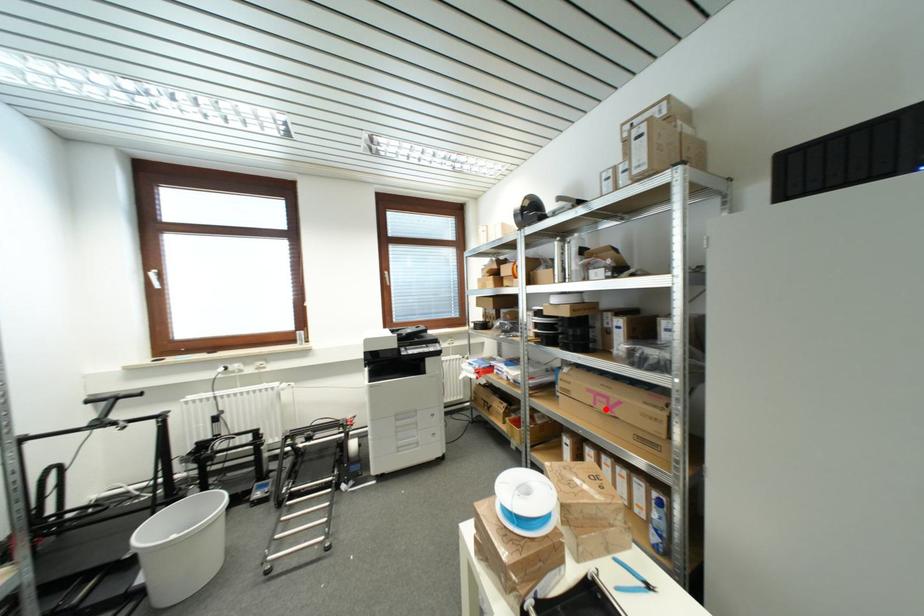
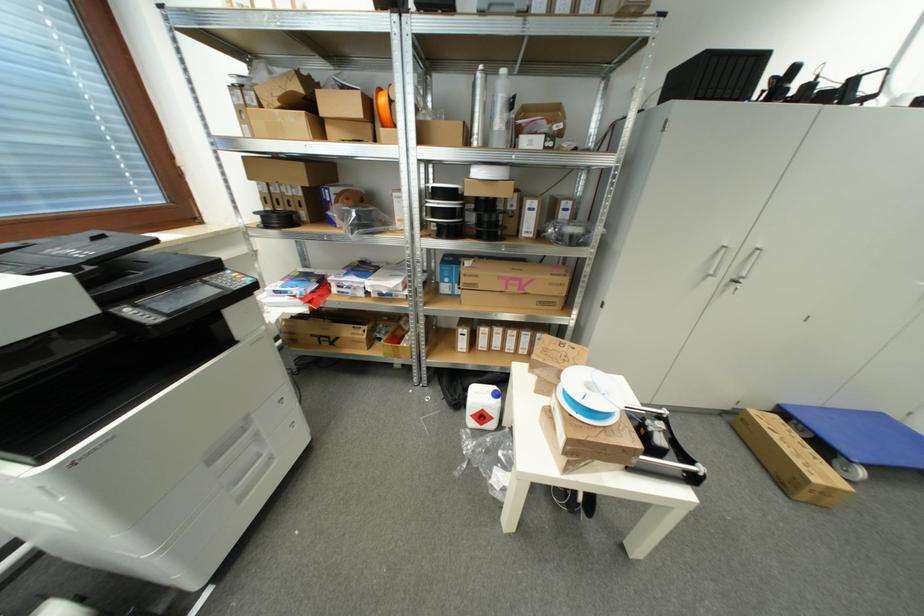
In the second image, find the point that corresponds to the highlighted location in the first image.

(517, 292)